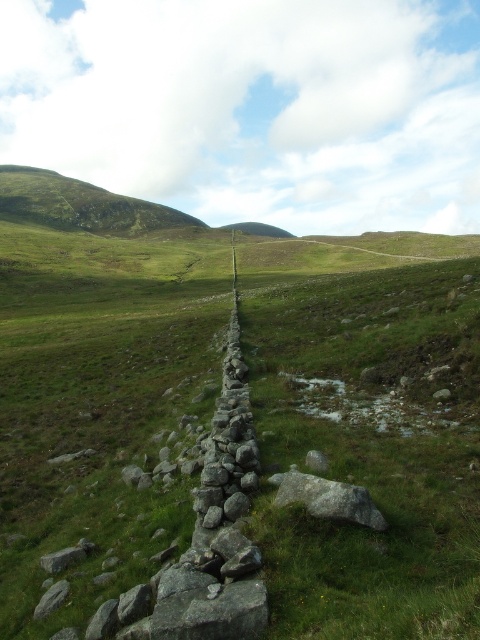
Is gray rough rock at center to the left of gray rough stone at lower left from the viewer's perspective?

No, gray rough rock at center is not to the left of gray rough stone at lower left.

How distant is gray rough rock at center from gray rough stone at lower left?

They are 12.11 feet apart.

Find the location of a particular element. The width and height of the screenshot is (480, 640). gray rough rock at center is located at coordinates (328, 499).